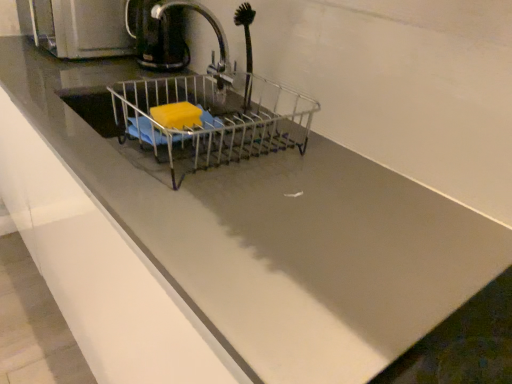
You are a GUI agent. You are given a task and a screenshot of the screen. Output one action in this format:
    pyautogui.click(x=<x>, y=<y>)
    Task: Click on the free space to the back side of black rubber brush at upper center
    The image size is (512, 384).
    Given the screenshot: What is the action you would take?
    pyautogui.click(x=236, y=96)